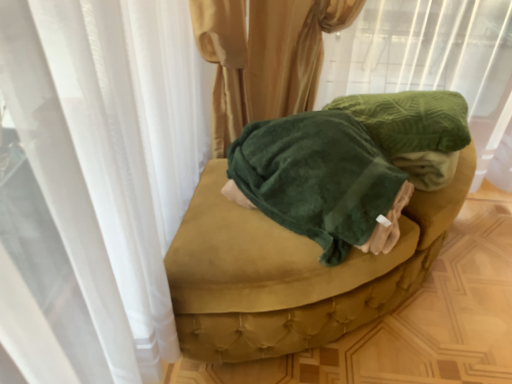
Question: Should I look upward or downward to see velvet green ottoman at center?

Choices:
 (A) down
 (B) up

Answer: (A)

Question: From the image's perspective, is green velvety fabric at upper center on top of velvet green ottoman at center?

Choices:
 (A) yes
 (B) no

Answer: (A)

Question: From a real-world perspective, does green velvety fabric at upper center sit lower than velvet green ottoman at center?

Choices:
 (A) no
 (B) yes

Answer: (A)

Question: Is green velvety fabric at upper center thinner than velvet green ottoman at center?

Choices:
 (A) yes
 (B) no

Answer: (A)

Question: Does green velvety fabric at upper center come behind velvet green ottoman at center?

Choices:
 (A) yes
 (B) no

Answer: (B)

Question: Is velvet green ottoman at center completely or partially inside green velvety fabric at upper center?

Choices:
 (A) yes
 (B) no

Answer: (B)

Question: Is green velvety fabric at upper center bigger than velvet green ottoman at center?

Choices:
 (A) no
 (B) yes

Answer: (B)

Question: From a real-world perspective, is velvet green ottoman at center beneath velvety green blanket at center?

Choices:
 (A) yes
 (B) no

Answer: (A)

Question: From the image's perspective, is velvet green ottoman at center over velvety green blanket at center?

Choices:
 (A) yes
 (B) no

Answer: (B)

Question: From a real-world perspective, is velvet green ottoman at center on top of velvety green blanket at center?

Choices:
 (A) no
 (B) yes

Answer: (A)

Question: Can you confirm if velvet green ottoman at center is taller than velvety green blanket at center?

Choices:
 (A) no
 (B) yes

Answer: (A)

Question: Can you confirm if velvet green ottoman at center is shorter than velvety green blanket at center?

Choices:
 (A) no
 (B) yes

Answer: (B)

Question: Does velvet green ottoman at center lie behind velvety green blanket at center?

Choices:
 (A) no
 (B) yes

Answer: (B)

Question: Is green velvety fabric at upper center smaller than velvety green blanket at center?

Choices:
 (A) no
 (B) yes

Answer: (A)